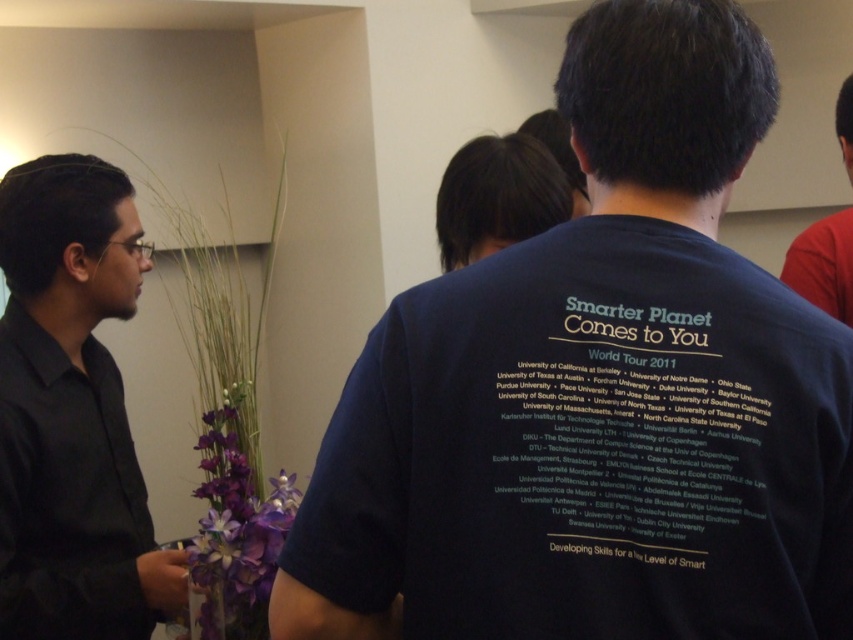
Consider the image. Between black shirt at left and dark brown hair at center, which one appears on the right side from the viewer's perspective?

dark brown hair at center is more to the right.

Is point (21, 417) less distant than point (517, 163)?

Yes, point (21, 417) is in front of point (517, 163).

Consider the image. Who is more forward, [0,579] or [540,209]?

Point [0,579] is in front.

The image size is (853, 640). I want to click on black shirt at left, so click(x=73, y=412).

Which is below, dark blue t-shirt at center or dark brown hair at center?

dark blue t-shirt at center is lower down.

Is dark blue t-shirt at center taller than dark brown hair at center?

Yes.

This screenshot has width=853, height=640. What are the coordinates of `dark blue t-shirt at center` in the screenshot? It's located at (598, 396).

Locate an element on the screen. This screenshot has height=640, width=853. dark blue t-shirt at center is located at coordinates (598, 396).

Does dark blue t-shirt at center come behind black shirt at left?

No.

Is dark blue t-shirt at center wider than black shirt at left?

Yes.

Which is in front, point (840, 541) or point (71, 269)?

Positioned in front is point (840, 541).

The height and width of the screenshot is (640, 853). Find the location of `dark blue t-shirt at center`. dark blue t-shirt at center is located at coordinates (598, 396).